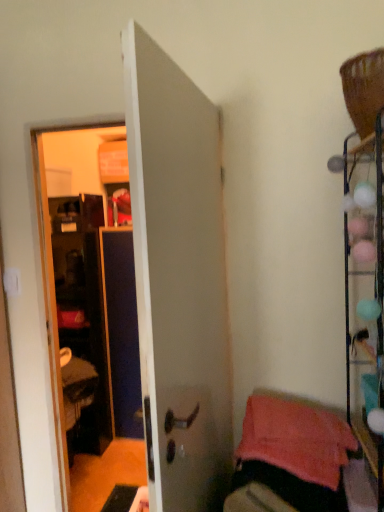
Question: From a real-world perspective, is pink soft towel at lower right located higher than metallic wire rack at right?

Choices:
 (A) yes
 (B) no

Answer: (B)

Question: Is pink soft towel at lower right shorter than metallic wire rack at right?

Choices:
 (A) no
 (B) yes

Answer: (B)

Question: Considering the relative sizes of pink soft towel at lower right and metallic wire rack at right in the image provided, is pink soft towel at lower right taller than metallic wire rack at right?

Choices:
 (A) yes
 (B) no

Answer: (B)

Question: Does pink soft towel at lower right appear on the right side of metallic wire rack at right?

Choices:
 (A) yes
 (B) no

Answer: (B)

Question: Considering the relative sizes of pink soft towel at lower right and metallic wire rack at right in the image provided, is pink soft towel at lower right wider than metallic wire rack at right?

Choices:
 (A) yes
 (B) no

Answer: (A)

Question: Is pink soft towel at lower right turned away from metallic wire rack at right?

Choices:
 (A) yes
 (B) no

Answer: (B)

Question: Could you tell me if white matte door at center is facing metallic wire rack at right?

Choices:
 (A) no
 (B) yes

Answer: (B)

Question: Can you confirm if white matte door at center is thinner than metallic wire rack at right?

Choices:
 (A) no
 (B) yes

Answer: (B)

Question: Is white matte door at center oriented away from metallic wire rack at right?

Choices:
 (A) yes
 (B) no

Answer: (A)

Question: Considering the relative positions of white matte door at center and metallic wire rack at right in the image provided, is white matte door at center in front of metallic wire rack at right?

Choices:
 (A) no
 (B) yes

Answer: (B)

Question: From a real-world perspective, is white matte door at center over metallic wire rack at right?

Choices:
 (A) yes
 (B) no

Answer: (B)

Question: Considering the relative sizes of white matte door at center and metallic wire rack at right in the image provided, is white matte door at center taller than metallic wire rack at right?

Choices:
 (A) no
 (B) yes

Answer: (B)

Question: Does metallic wire rack at right lie in front of white matte door at center?

Choices:
 (A) yes
 (B) no

Answer: (B)